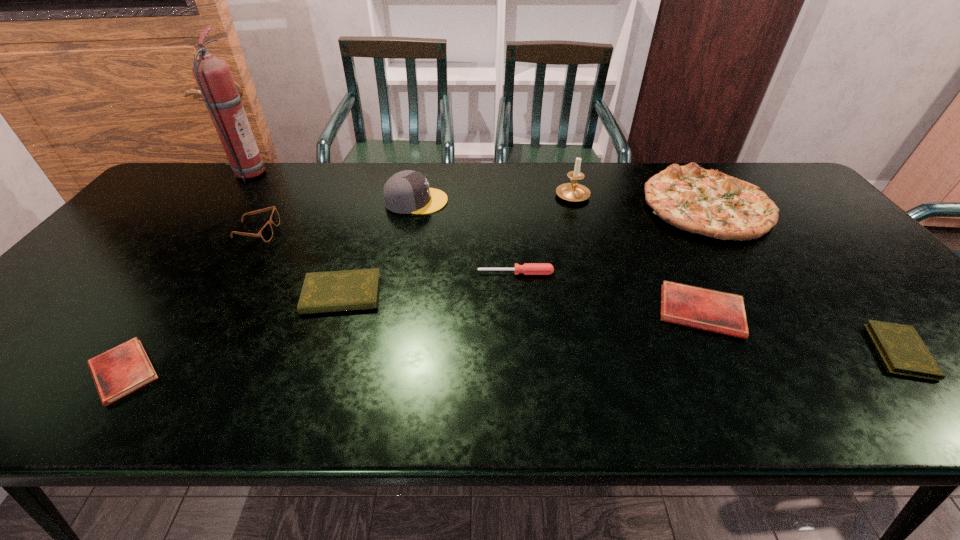
Where is `vacant point at the near edge`? The image size is (960, 540). vacant point at the near edge is located at coordinates (670, 410).

Identify the location of vacant space at the right edge of the desktop. pyautogui.click(x=883, y=309).

In the image, there is a desktop. Identify the location of vacant space at the far left corner. (225, 173).

Where is `empty location between the farther green diary and the screwdriver`? empty location between the farther green diary and the screwdriver is located at coordinates (429, 284).

The width and height of the screenshot is (960, 540). I want to click on vacant space that's between the sixth shortest object and the nearer green diary, so click(579, 291).

Find the location of a particular element. free point between the smaller green diary and the right red diary is located at coordinates (x=801, y=332).

Where is `free space between the sunglasses and the bigger red diary`? This screenshot has width=960, height=540. free space between the sunglasses and the bigger red diary is located at coordinates (479, 272).

Locate an element on the screen. vacant space that's between the screwdriver and the left green diary is located at coordinates (429, 284).

Locate an element on the screen. vacant area that lies between the right green diary and the pizza is located at coordinates click(x=804, y=278).

Identify the location of vacant area between the fourth tallest object and the sixth shortest object. The width and height of the screenshot is (960, 540). (481, 218).